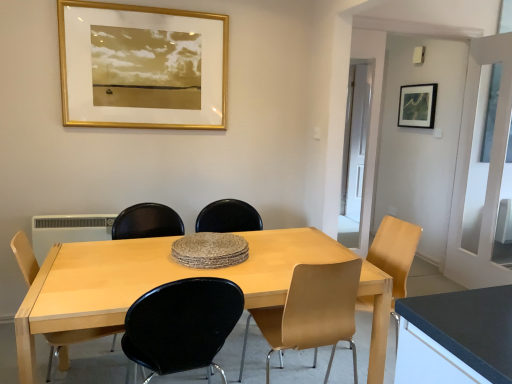
I want to click on vacant region above white plastic radiator at lower left (from a real-world perspective), so click(72, 215).